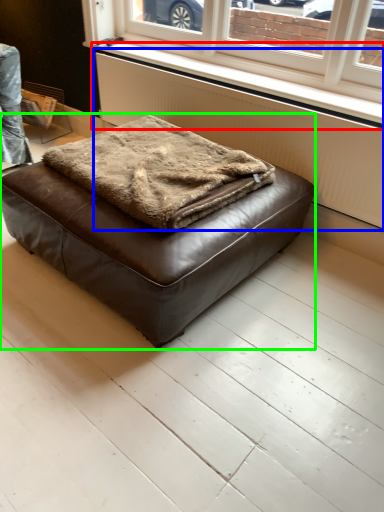
Question: Considering the real-world distances, which object is closest to window sill (highlighted by a red box)? radiator (highlighted by a blue box) or furniture (highlighted by a green box).

Choices:
 (A) radiator
 (B) furniture

Answer: (A)